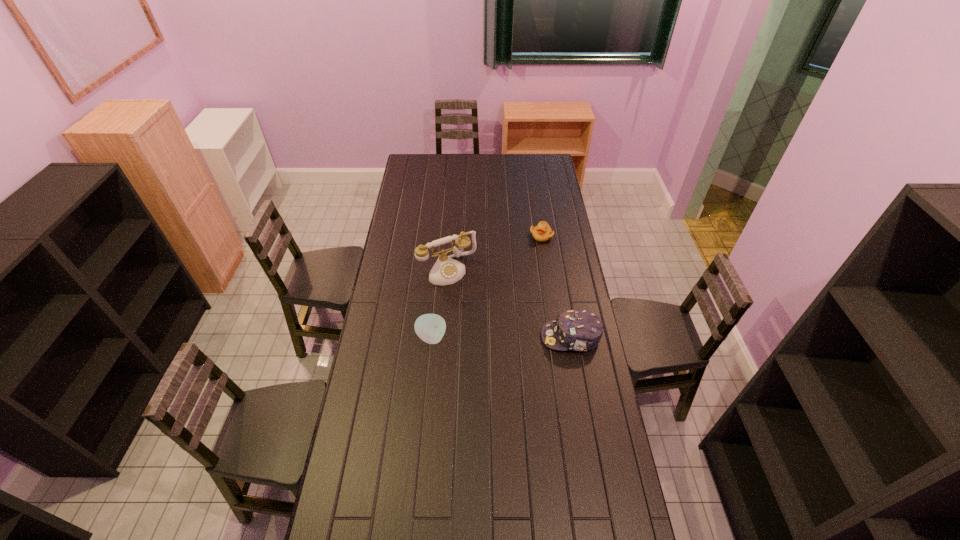
You are a GUI agent. You are given a task and a screenshot of the screen. Output one action in this format:
    pyautogui.click(x=<x>, y=<y>)
    Task: Click on the apple
    Image resolution: width=960 pixels, height=540 pixels.
    Given the screenshot: What is the action you would take?
    pyautogui.click(x=430, y=328)

Find the location of `headwear`. headwear is located at coordinates (578, 330).

The image size is (960, 540). I want to click on the farthest object, so click(542, 232).

The width and height of the screenshot is (960, 540). Identify the location of duckling. (542, 232).

Locate an element on the screen. This screenshot has width=960, height=540. telephone is located at coordinates (446, 270).

Locate an element on the screen. the third nearest object is located at coordinates (446, 270).

Locate an element on the screen. The height and width of the screenshot is (540, 960). vacant space located on the left of the apple is located at coordinates (387, 338).

Where is `vacant space located on the front-facing side of the headwear`? Image resolution: width=960 pixels, height=540 pixels. vacant space located on the front-facing side of the headwear is located at coordinates (457, 337).

Locate an element on the screen. The height and width of the screenshot is (540, 960). free space located on the front-facing side of the headwear is located at coordinates (447, 337).

I want to click on vacant space situated on the front-facing side of the headwear, so click(x=505, y=337).